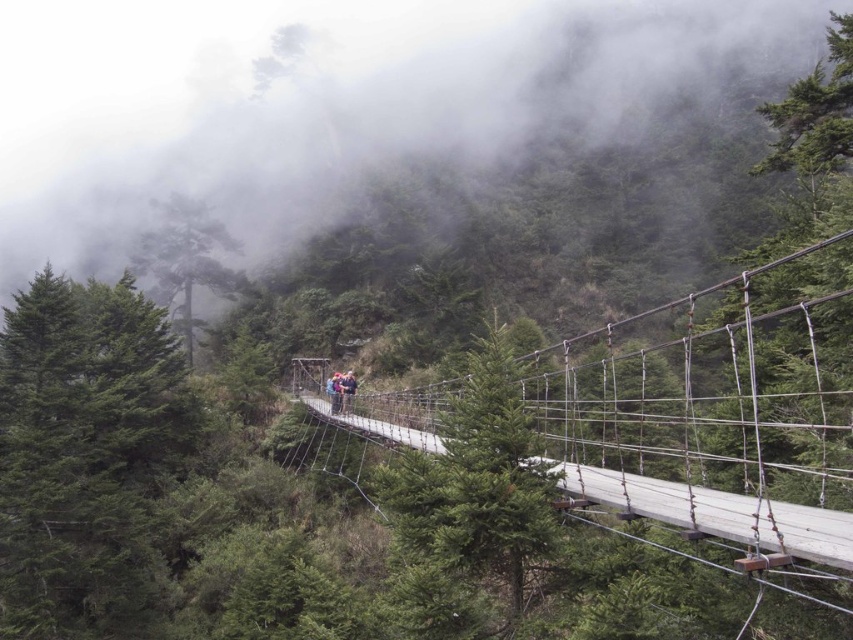
Question: Which point appears farthest from the camera in this image?

Choices:
 (A) (86, 90)
 (B) (343, 410)

Answer: (A)

Question: Can you confirm if wooden suspension bridge at center is smaller than dark blue jeans at center?

Choices:
 (A) no
 (B) yes

Answer: (A)

Question: Among these points, which one is nearest to the camera?

Choices:
 (A) (363, 16)
 (B) (579, 484)

Answer: (B)

Question: From the image, what is the correct spatial relationship of white foggy cloud at upper center in relation to dark blue jeans at center?

Choices:
 (A) left
 (B) right

Answer: (A)

Question: Is wooden suspension bridge at center wider than dark blue jeans at center?

Choices:
 (A) no
 (B) yes

Answer: (B)

Question: Estimate the real-world distances between objects in this image. Which object is farther from the wooden suspension bridge at center?

Choices:
 (A) white foggy cloud at upper center
 (B) dark blue jeans at center

Answer: (A)